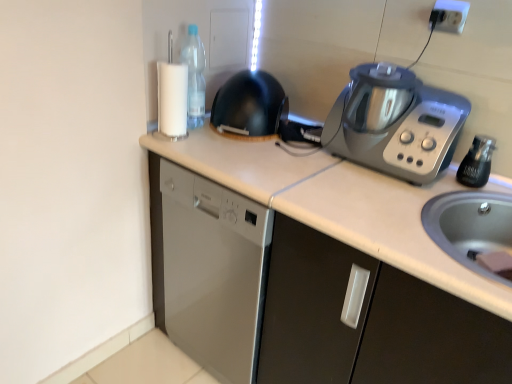
This screenshot has height=384, width=512. I want to click on free space between silver metallic kitchen appliance at upper right and black glass bottle at right, placed as the 2th bottle when sorted from top to bottom, so click(x=454, y=191).